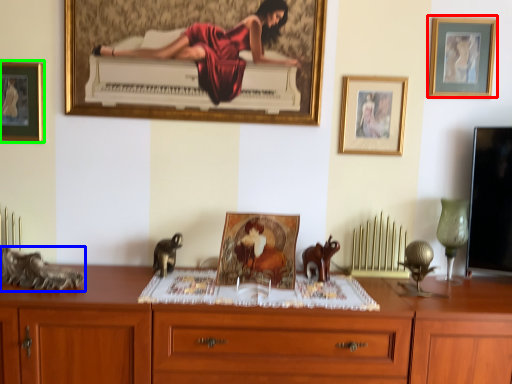
Question: Based on their relative distances, which object is nearer to picture frame (highlighted by a red box)? Choose from animal (highlighted by a blue box) and picture frame (highlighted by a green box).

Choices:
 (A) animal
 (B) picture frame

Answer: (B)